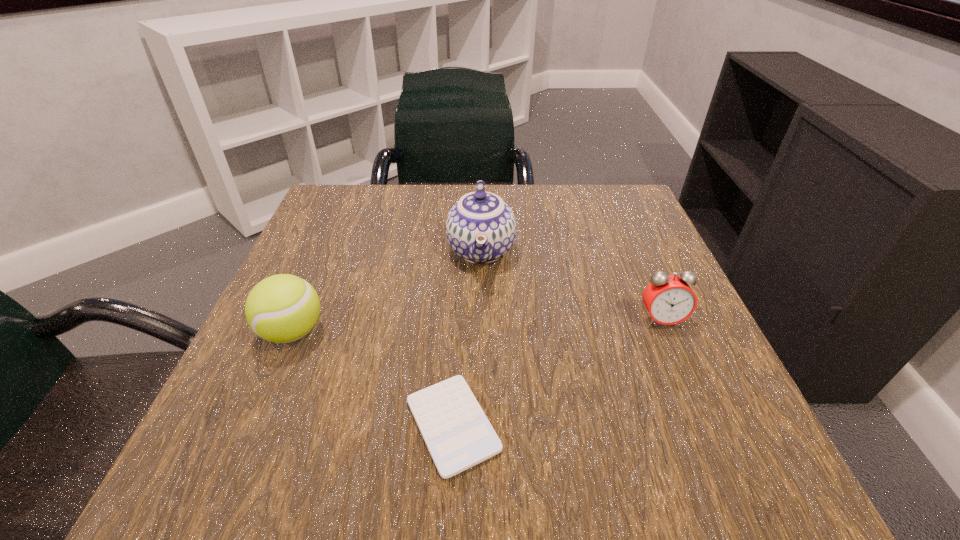
At what (x,y) coordinates should I click in order to perform the action: click on free spot between the leftmost object and the calculator. Please return your answer as a coordinate pair (x, y). Looking at the image, I should click on (372, 379).

In order to click on vacant area between the rightmost object and the leftmost object in this screenshot , I will do `click(477, 326)`.

Select which object appears as the third closest to the leftmost object. Please provide its 2D coordinates. Your answer should be formatted as a tuple, i.e. [(x, y)], where the tuple contains the x and y coordinates of a point satisfying the conditions above.

[(669, 299)]

The image size is (960, 540). Find the location of `object that is the third closest one to the alarm clock`. object that is the third closest one to the alarm clock is located at coordinates (x=283, y=308).